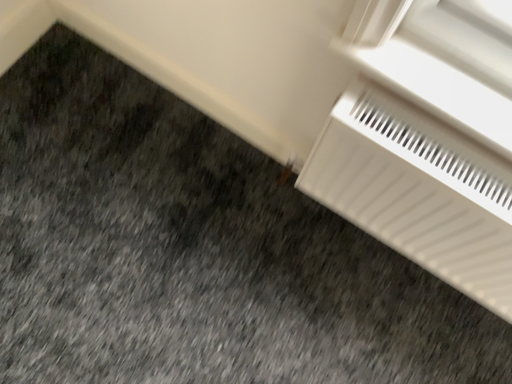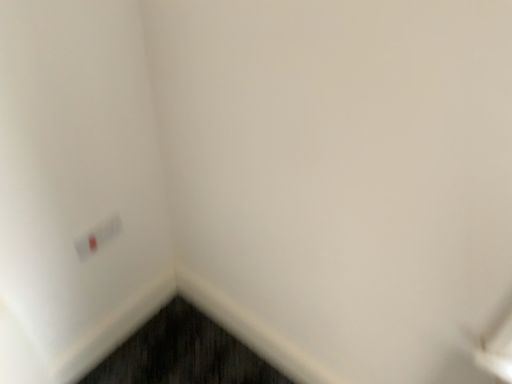
Question: How did the camera likely rotate when shooting the video?

Choices:
 (A) rotated downward
 (B) rotated upward

Answer: (B)